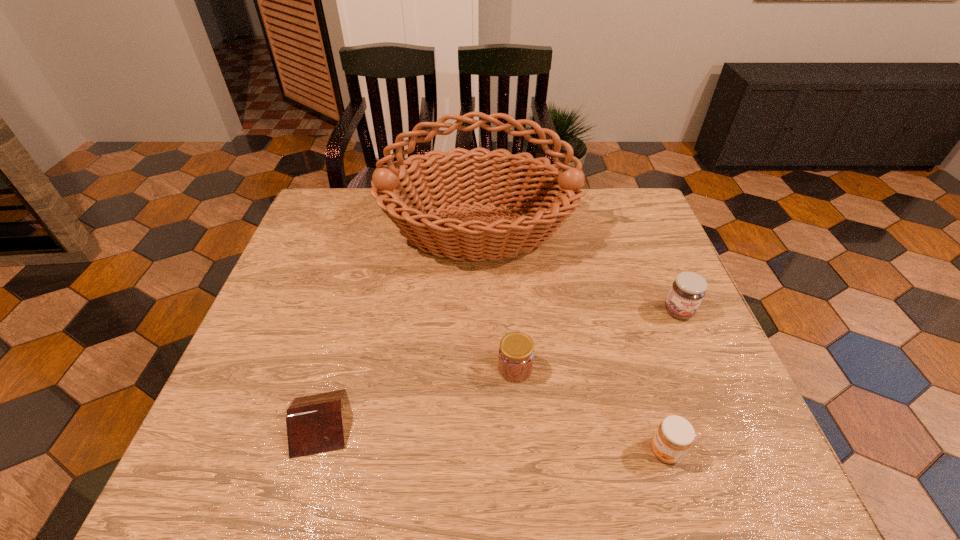
Locate an element on the screen. This screenshot has width=960, height=540. the farthest object is located at coordinates tap(552, 199).

Find the location of a particular element. The height and width of the screenshot is (540, 960). the tallest object is located at coordinates (552, 199).

The image size is (960, 540). I want to click on the tallest jam, so click(688, 289).

You are a GUI agent. You are given a task and a screenshot of the screen. Output one action in this format:
    pyautogui.click(x=<x>, y=<y>)
    Task: Click on the farthest jam
    The height and width of the screenshot is (540, 960).
    Given the screenshot: What is the action you would take?
    pyautogui.click(x=688, y=289)

This screenshot has width=960, height=540. I want to click on the leftmost jam, so click(x=516, y=352).

This screenshot has height=540, width=960. I want to click on the second farthest jam, so click(x=516, y=352).

Find the location of `the second jam from right to left`. the second jam from right to left is located at coordinates (674, 436).

Where is `the nearest jam`? This screenshot has height=540, width=960. the nearest jam is located at coordinates (674, 436).

Find the location of a particular element. the shortest object is located at coordinates (314, 423).

At what (x,y) coordinates should I click in order to perform the action: click on vacant region located on the right of the basket. Please return your answer as a coordinate pair (x, y). This screenshot has height=540, width=960. Looking at the image, I should click on (660, 231).